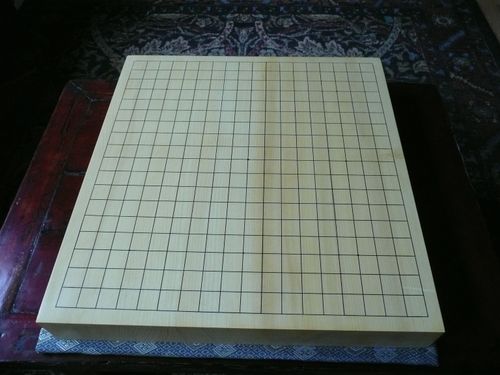
The image size is (500, 375). Find the location of `top corner of wood table`. top corner of wood table is located at coordinates [436, 87], [69, 80].